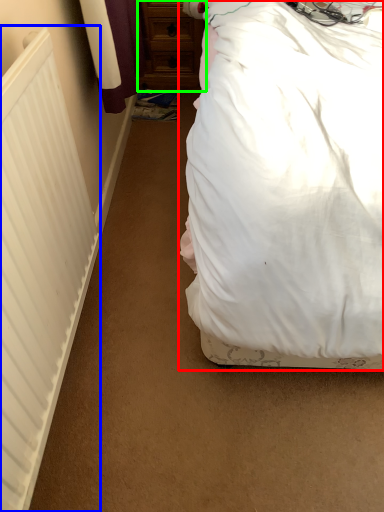
Question: Which object is the farthest from bed (highlighted by a red box)? Choose among these: radiator (highlighted by a blue box) or chest of drawers (highlighted by a green box).

Choices:
 (A) radiator
 (B) chest of drawers

Answer: (B)